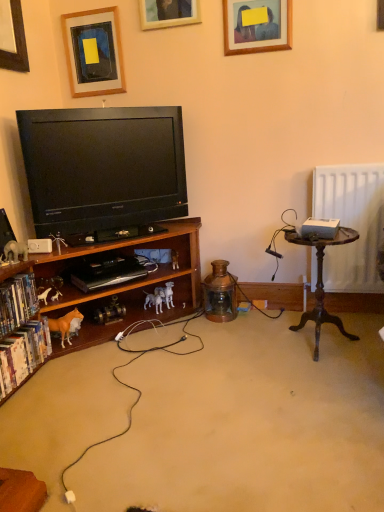
At what (x,y) coordinates should I click in order to perform the action: click on vacant space to the left of copper glass lantern at center, which is the first toy from right to left. Please return your answer as a coordinate pair (x, y). The height and width of the screenshot is (512, 384). Looking at the image, I should click on (190, 321).